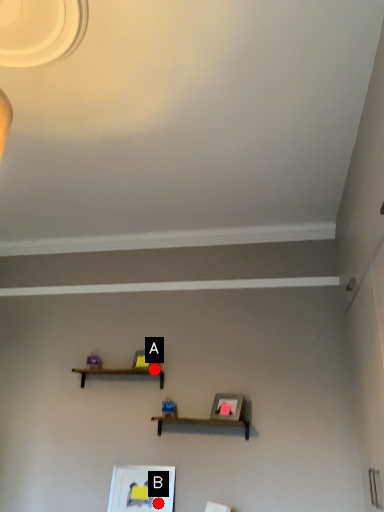
Question: Two points are circled on the image, labeled by A and B beside each circle. Which point is further to the camera?

Choices:
 (A) A is further
 (B) B is further

Answer: (A)